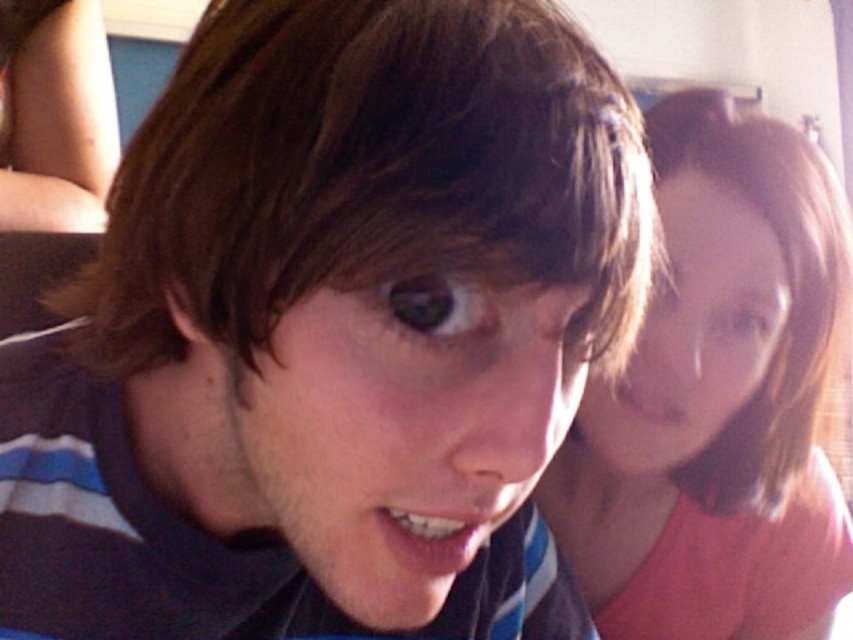
Is pink matte shirt at upper right below matte black shirt at upper left?

Yes.

Is pink matte shirt at upper right to the right of matte black shirt at upper left from the viewer's perspective?

Indeed, pink matte shirt at upper right is positioned on the right side of matte black shirt at upper left.

Measure the distance between pink matte shirt at upper right and camera.

pink matte shirt at upper right is 21.57 inches away from camera.

Image resolution: width=853 pixels, height=640 pixels. Identify the location of pink matte shirt at upper right. (717, 400).